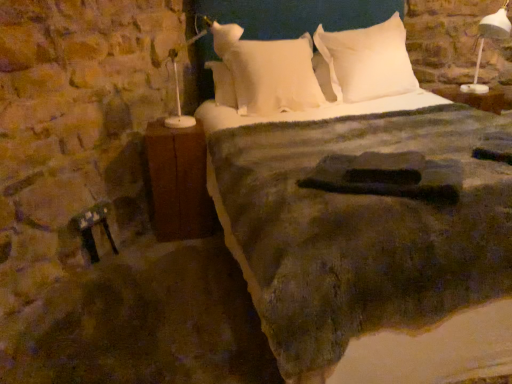
Where is `free space to the left of brown wood nightstand at left`? The image size is (512, 384). free space to the left of brown wood nightstand at left is located at coordinates (140, 242).